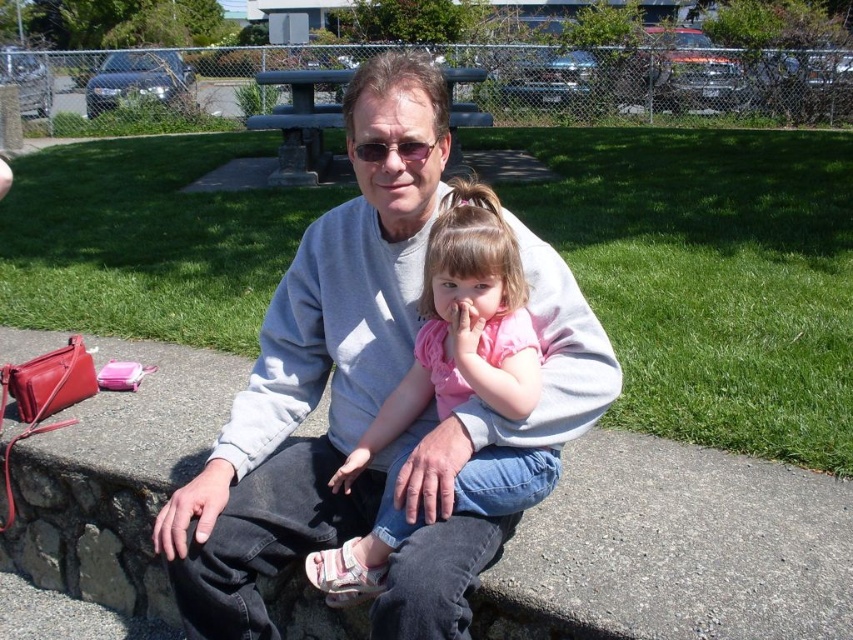
You are a photographer trying to capture a photo of the gray sweatshirt at center and the pink fabric shirt at center. Which one is located to the right of the other?

The gray sweatshirt at center is positioned on the left side of pink fabric shirt at center, so the pink fabric shirt at center is to the right of the gray sweatshirt at center.

You are a photographer trying to capture a photo of the gray sweatshirt at center and the pink fabric shirt at center. You want to ensure both are fully visible in the frame. Given that your camera has a fixed width, which object should you adjust your focus to prioritize to avoid cropping either?

Since the gray sweatshirt at center is wider than the pink fabric shirt at center, you should prioritize focusing on the gray sweatshirt at center to ensure both fit within the camera frame without cropping.